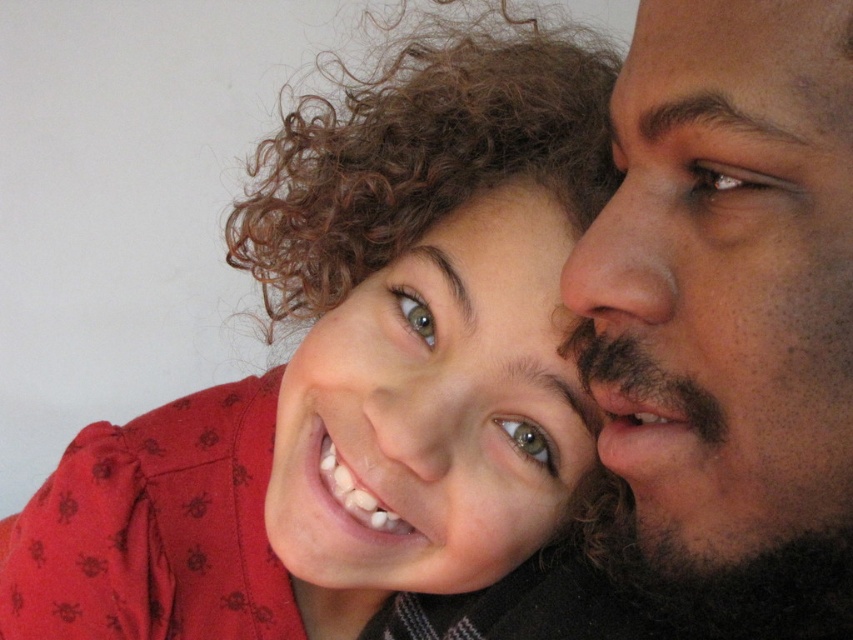
From the picture: You are taking a photo of two people standing in front of you. You notice two points marked on their bodies at coordinates point (136, 481) and point (764, 289). Which point is closer to your camera?

Point (136, 481) is closer to the camera than point (764, 289).